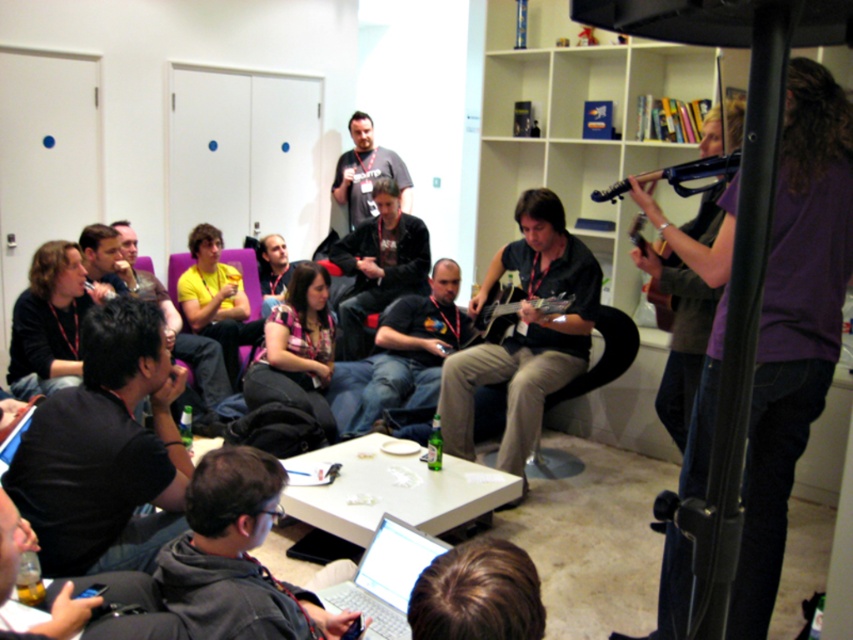
Who is positioned more to the right, gray hoodie at lower center or dark gray hoodie at center?

gray hoodie at lower center

Describe the element at coordinates (236, 557) in the screenshot. Image resolution: width=853 pixels, height=640 pixels. I see `gray hoodie at lower center` at that location.

Where is `gray hoodie at lower center`? gray hoodie at lower center is located at coordinates (236, 557).

Consider the image. Is silver metallic laptop at lower center positioned behind matte black guitar at upper right?

No.

Is silver metallic laptop at lower center shorter than matte black guitar at upper right?

Incorrect, silver metallic laptop at lower center's height does not fall short of matte black guitar at upper right's.

Locate an element on the screen. silver metallic laptop at lower center is located at coordinates (386, 577).

Does black fabric shirt at center have a larger size compared to dark gray hoodie at center?

Yes.

Is black fabric shirt at center to the left of dark gray hoodie at center from the viewer's perspective?

No, black fabric shirt at center is not to the left of dark gray hoodie at center.

Does point (430, 300) lie behind point (338, 337)?

No, it is in front of (338, 337).

Identify the location of black fabric shirt at center. (413, 348).